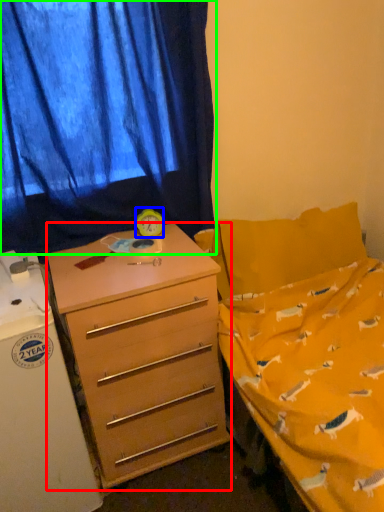
Question: Which object is the farthest from desk (highlighted by a red box)? Choose among these: clock (highlighted by a blue box) or curtain (highlighted by a green box).

Choices:
 (A) clock
 (B) curtain

Answer: (B)